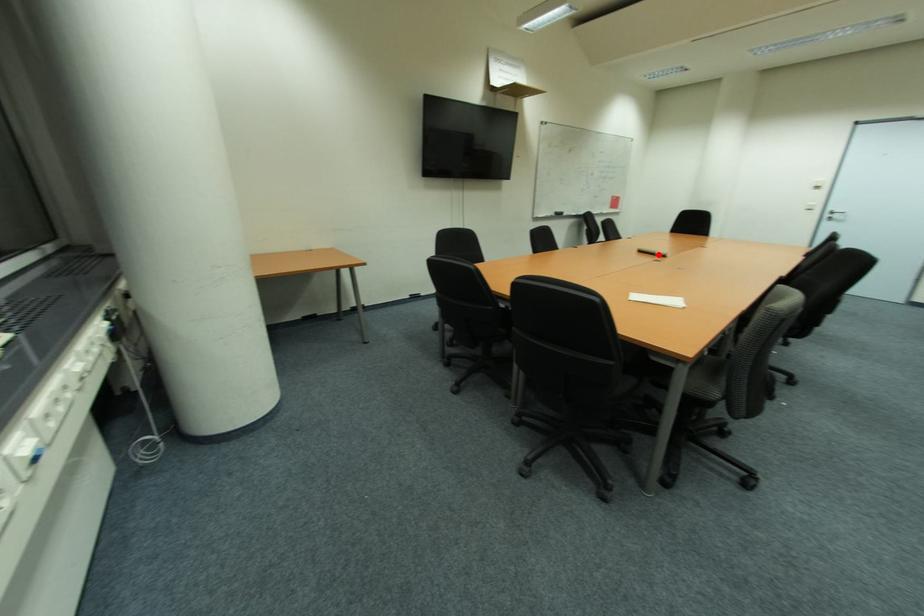
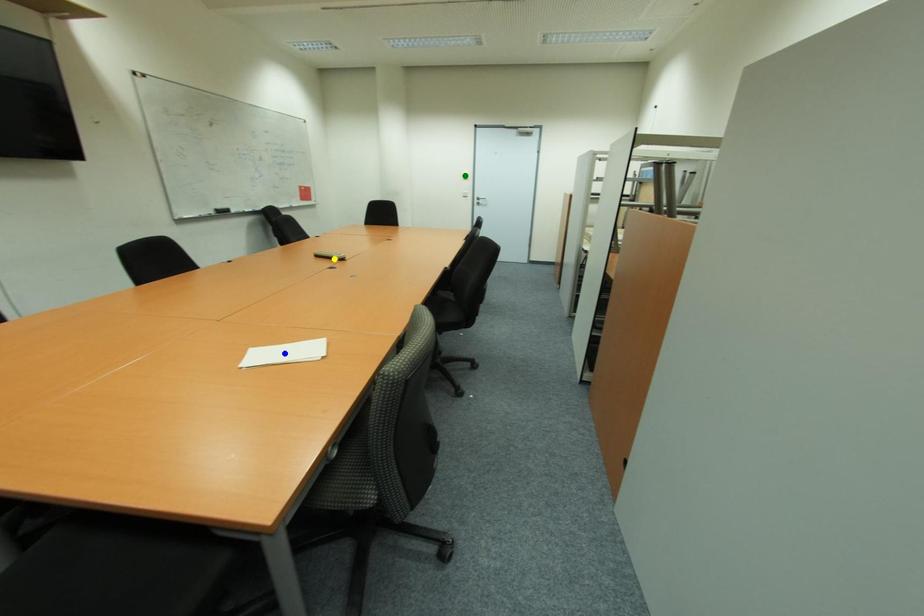
Question: I am providing you with two images of the same scene from different viewpoints. A red point is marked on the first image. You are given multiple points on the second image. Which mark in image 2 goes with the point in image 1?

Choices:
 (A) green point
 (B) blue point
 (C) yellow point

Answer: (C)